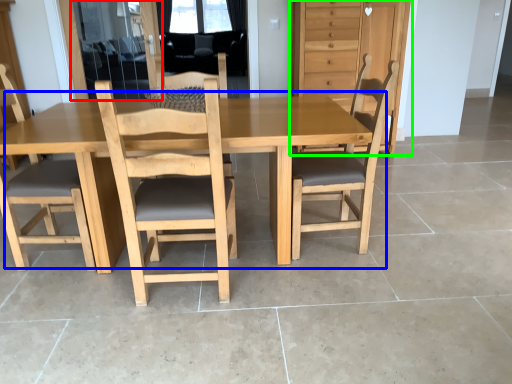
Question: Estimate the real-world distances between objects in this image. Which object is closer to screen door (highlighted by a red box), table (highlighted by a blue box) or dresser (highlighted by a green box)?

Choices:
 (A) table
 (B) dresser

Answer: (B)